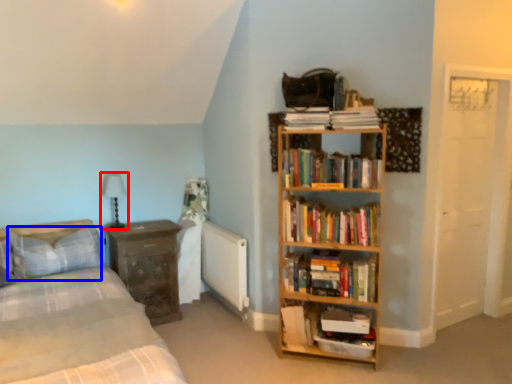
Question: Which object is closer to the camera taking this photo, table lamp (highlighted by a red box) or pillow (highlighted by a blue box)?

Choices:
 (A) table lamp
 (B) pillow

Answer: (B)